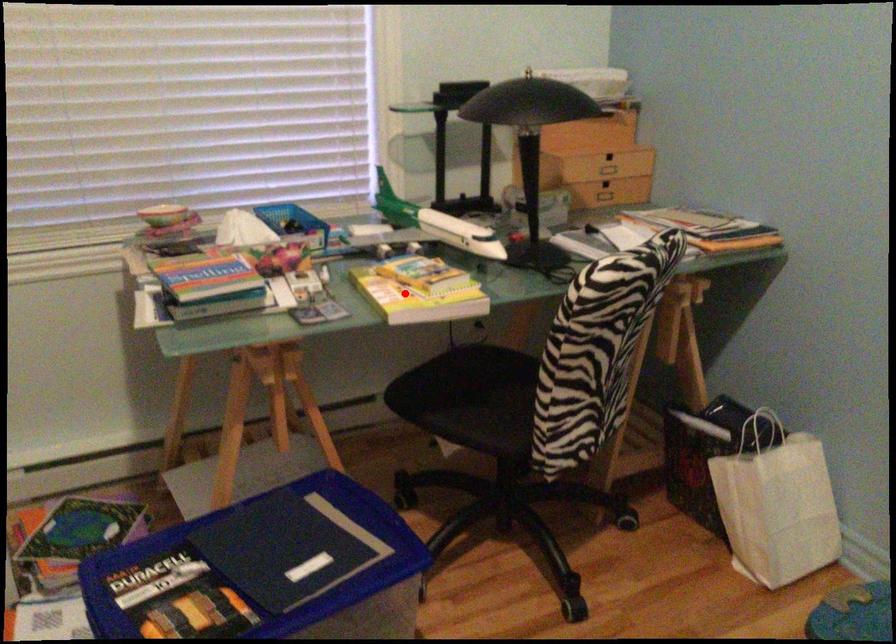
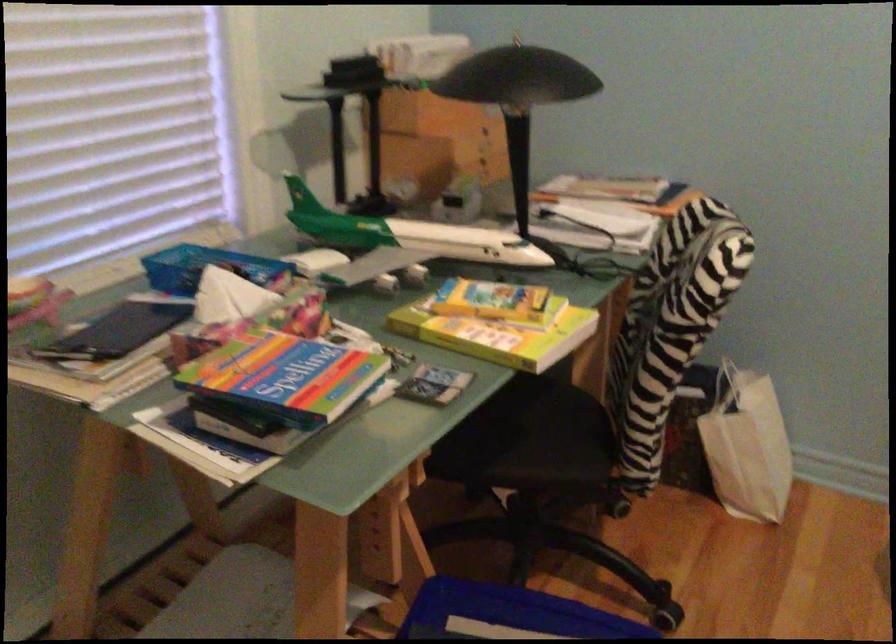
Question: A red point is marked in image1. In image2, is the corresponding 3D point closer to the camera or farther? Reply with the corresponding letter.

Choices:
 (A) The corresponding 3D point is closer.
 (B) The corresponding 3D point is farther.

Answer: (A)